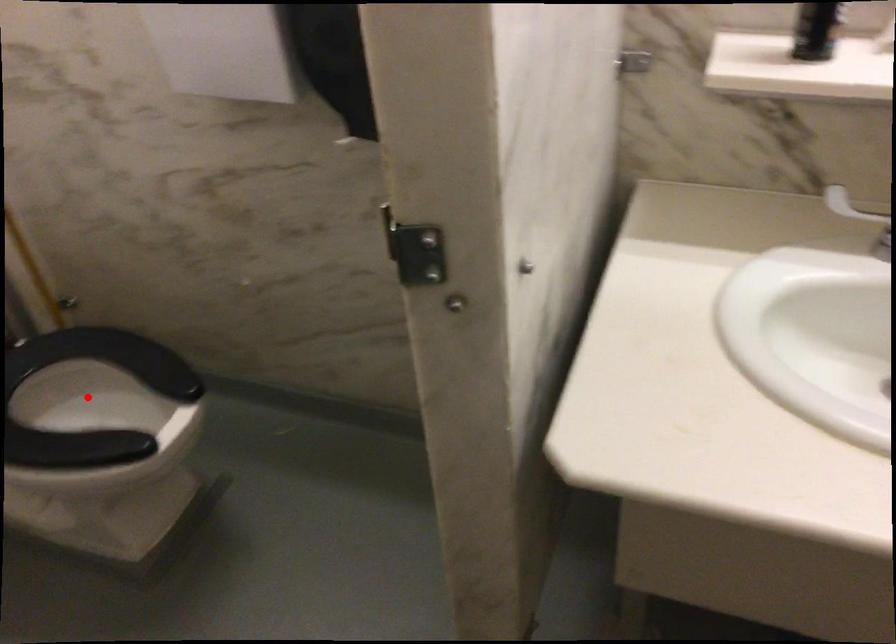
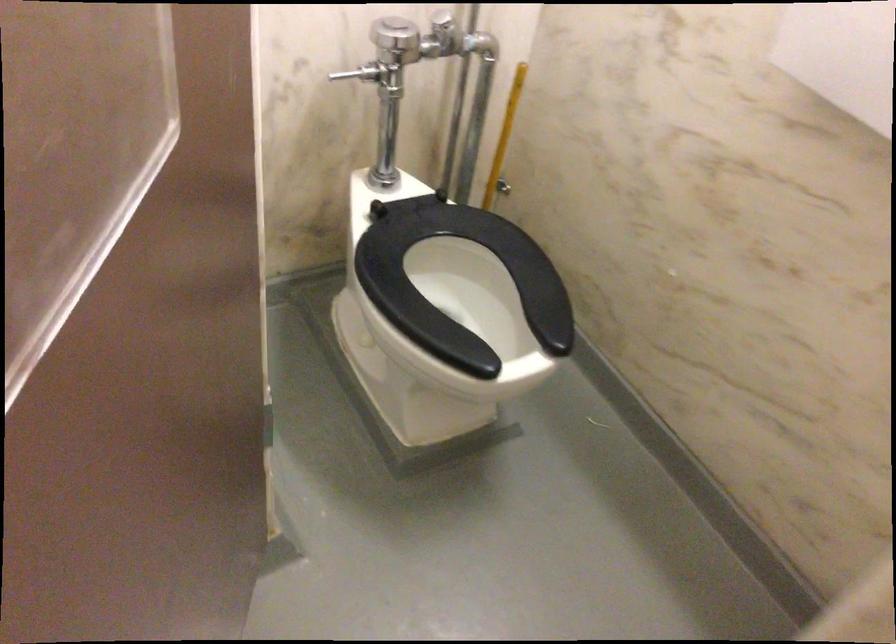
Find the pixel in the second image that matches the highlighted location in the first image.

(461, 285)